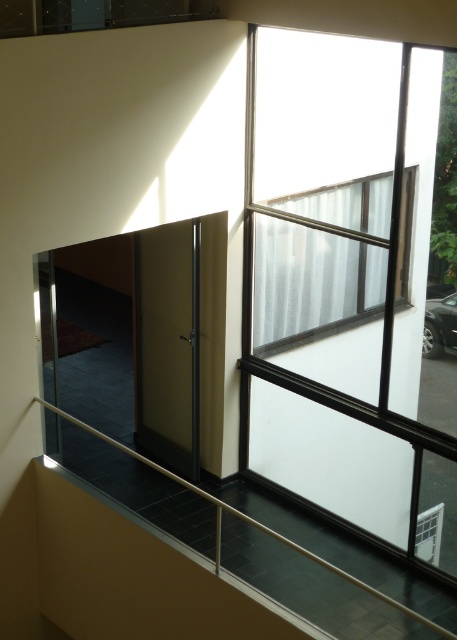
Can you confirm if clear glass window at upper center is thinner than metallic silver railing at lower center?

Yes, clear glass window at upper center is thinner than metallic silver railing at lower center.

In the scene shown: Can you confirm if clear glass window at upper center is taller than metallic silver railing at lower center?

Correct, clear glass window at upper center is much taller as metallic silver railing at lower center.

Identify the location of clear glass window at upper center. This screenshot has width=457, height=640. (311, 284).

Is point (290, 368) positioned after point (344, 317)?

Yes.

Who is more forward, (333,164) or (281,282)?

Point (333,164)

Where is `clear glass window at upper right`? This screenshot has width=457, height=640. clear glass window at upper right is located at coordinates (345, 280).

Which of these two, clear glass window at upper right or metallic silver railing at lower center, stands shorter?

With less height is metallic silver railing at lower center.

Can you confirm if clear glass window at upper right is positioned above metallic silver railing at lower center?

Yes.

Is point (352, 257) less distant than point (259, 522)?

No, (352, 257) is further to viewer.

This screenshot has height=640, width=457. In order to click on clear glass window at upper right in this screenshot , I will do `click(345, 280)`.